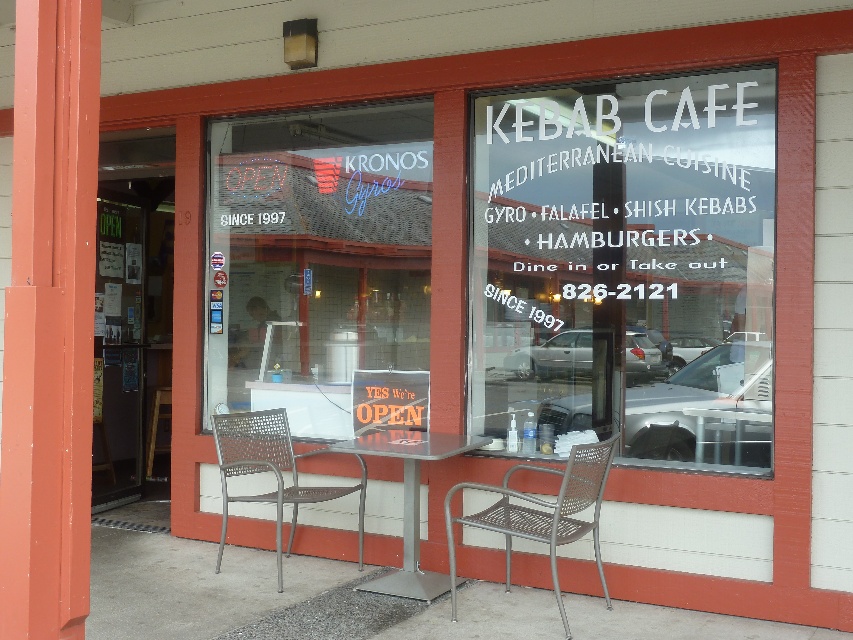
Based on the photo, can you confirm if transparent glass window at center is bigger than metallic silver table at center?

Yes, transparent glass window at center is bigger than metallic silver table at center.

I want to click on transparent glass window at center, so click(625, 268).

Is point (447, 513) closer to viewer compared to point (361, 484)?

Yes, it is.

Between metallic mesh chair at lower center and metallic mesh chair at center, which one is positioned higher?

metallic mesh chair at center is above.

This screenshot has width=853, height=640. I want to click on metallic mesh chair at lower center, so click(x=543, y=513).

Who is taller, transparent glass sign at center or metallic silver table at center?

transparent glass sign at center is taller.

Can you confirm if transparent glass sign at center is positioned above metallic silver table at center?

Yes.

Is point (218, 211) positioned in front of point (380, 449)?

No.

Locate an element on the screen. This screenshot has width=853, height=640. transparent glass sign at center is located at coordinates (320, 268).